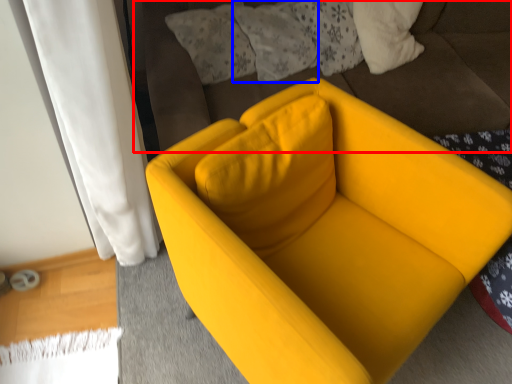
Question: Which object appears closest to the camera in this image, bedding (highlighted by a red box) or pillow (highlighted by a blue box)?

Choices:
 (A) bedding
 (B) pillow

Answer: (A)